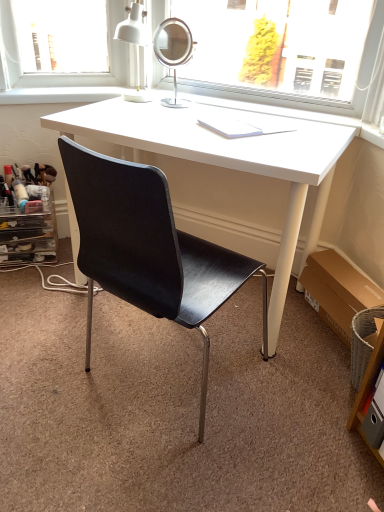
Question: From the image's perspective, relative to white paper at center, is white matte table lamp at upper center above or below?

Choices:
 (A) below
 (B) above

Answer: (B)

Question: In terms of size, does white matte table lamp at upper center appear bigger or smaller than white paper at center?

Choices:
 (A) small
 (B) big

Answer: (B)

Question: Estimate the real-world distances between objects in this image. Which object is farther from the white paper at center?

Choices:
 (A) clear plastic drawer at lower left, which is counted as the 2th shelf, starting from the front
 (B) chrome/metallic mirror at upper center
 (C) black leather chair at center
 (D) white matte table lamp at upper center
 (E) white glossy desk at center

Answer: (A)

Question: Estimate the real-world distances between objects in this image. Which object is closer to the wooden shelf at lower right, which is counted as the 2th shelf, starting from the top?

Choices:
 (A) brown cardboard box at lower right
 (B) white glossy desk at center
 (C) chrome/metallic mirror at upper center
 (D) white paper at center
 (E) black leather chair at center

Answer: (A)